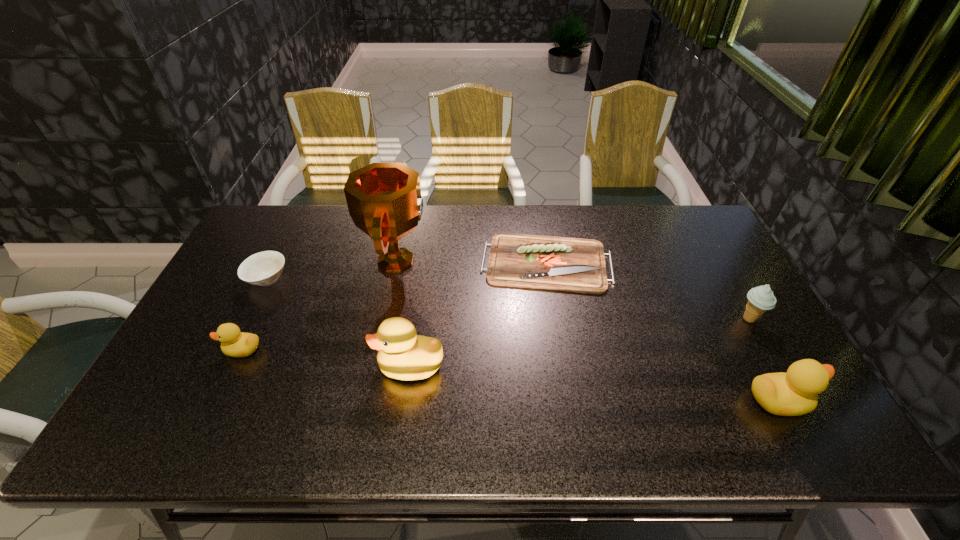
Identify the location of free space between the shortest duckling and the award. (320, 305).

Identify which object is located as the second nearest to the fourth farthest object. Please provide its 2D coordinates. Your answer should be formatted as a tuple, i.e. [(x, y)], where the tuple contains the x and y coordinates of a point satisfying the conditions above.

[(566, 264)]

Choose which object is the fourth nearest neighbor to the fourth farthest object. Please provide its 2D coordinates. Your answer should be formatted as a tuple, i.e. [(x, y)], where the tuple contains the x and y coordinates of a point satisfying the conditions above.

[(384, 200)]

Locate which duckling is the second closest to the rightmost duckling. Please provide its 2D coordinates. Your answer should be formatted as a tuple, i.e. [(x, y)], where the tuple contains the x and y coordinates of a point satisfying the conditions above.

[(234, 343)]

Identify the location of the third closest duckling to the fourth nearest object. Image resolution: width=960 pixels, height=540 pixels. (234, 343).

This screenshot has height=540, width=960. In order to click on vacant space that satisfies the following two spatial constraints: 1. on the front side of the shortest object; 2. on the face of the shortest duckling in this screenshot , I will do `click(561, 349)`.